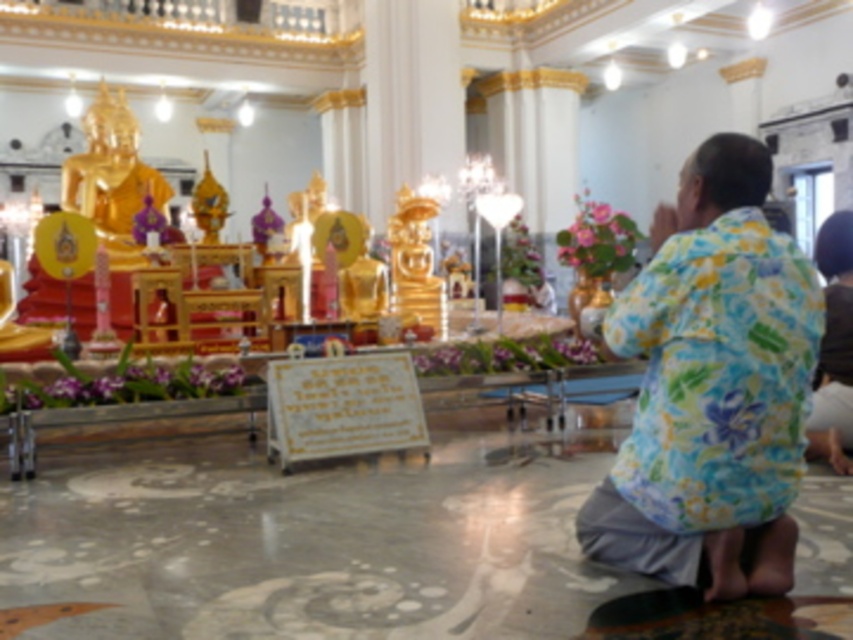
Question: Does floral fabric shirt at center appear over floral print shirt at lower right?

Choices:
 (A) no
 (B) yes

Answer: (A)

Question: Does floral fabric shirt at center come behind floral print shirt at lower right?

Choices:
 (A) no
 (B) yes

Answer: (A)

Question: Does floral fabric shirt at center appear on the right side of floral print shirt at lower right?

Choices:
 (A) no
 (B) yes

Answer: (A)

Question: Which point is farther from the camera taking this photo?

Choices:
 (A) (759, 481)
 (B) (824, 332)

Answer: (B)

Question: Which point is farther to the camera?

Choices:
 (A) floral fabric shirt at center
 (B) floral print shirt at lower right

Answer: (B)